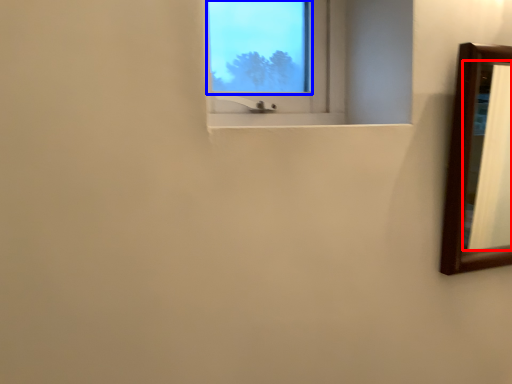
Question: Which object is closer to the camera taking this photo, mirror (highlighted by a red box) or window screen (highlighted by a blue box)?

Choices:
 (A) mirror
 (B) window screen

Answer: (B)